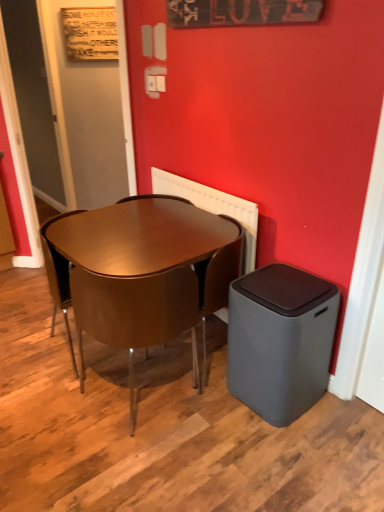
The image size is (384, 512). Identify the location of vacant space to the left of glossy brown chair at center, marked as the third chair in a right-to-left arrangement. click(x=30, y=346).